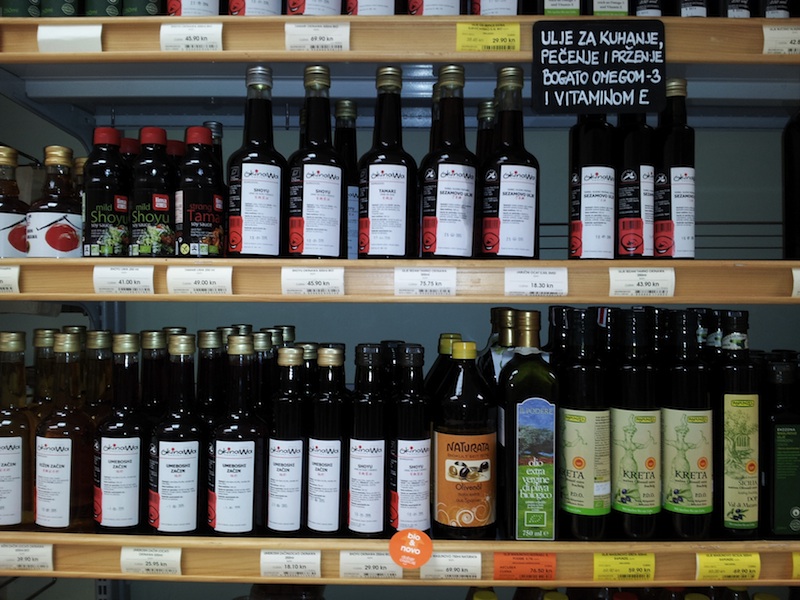
At what (x,y) coordinates should I click in order to perform the action: click on glass. Please return your answer as a coordinate pair (x, y). The width and height of the screenshot is (800, 600). Looking at the image, I should click on (186, 418), (290, 408), (413, 422), (614, 385), (192, 174).